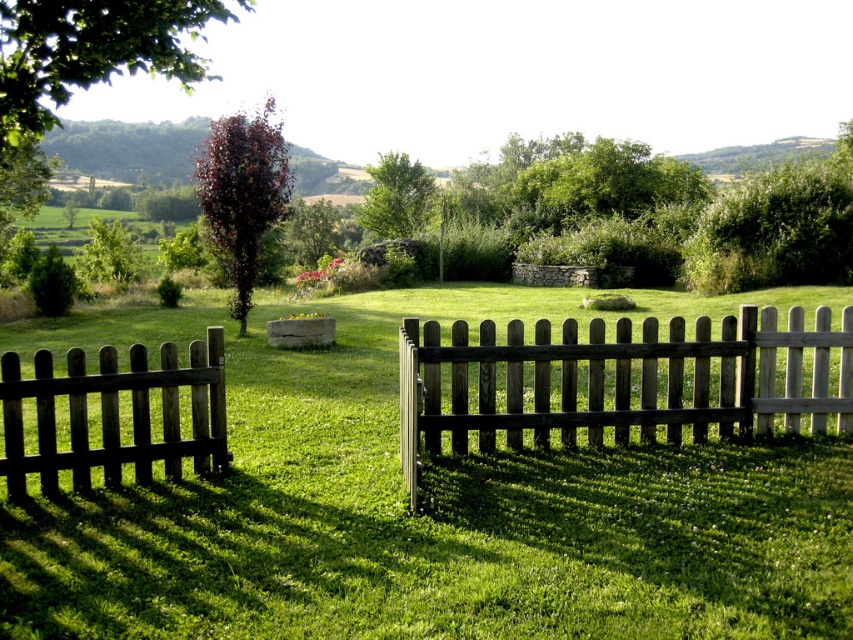
Question: Which point appears closest to the camera in this image?

Choices:
 (A) (618, 397)
 (B) (22, 65)
 (C) (115, 380)

Answer: (B)

Question: Observing the image, what is the correct spatial positioning of wooden picket fence at center in reference to green leafy tree at upper left?

Choices:
 (A) right
 (B) left

Answer: (A)

Question: Observing the image, what is the correct spatial positioning of dark purple leafy tree at center in reference to green leafy tree at center?

Choices:
 (A) below
 (B) above

Answer: (A)

Question: Which of the following is the farthest from the observer?

Choices:
 (A) dark purple leafy tree at center
 (B) green leafy tree at upper left
 (C) wooden picket fence at center

Answer: (A)

Question: Can you confirm if wooden picket fence at center is bigger than green leafy tree at center?

Choices:
 (A) no
 (B) yes

Answer: (A)

Question: Which of the following is the farthest from the observer?

Choices:
 (A) (367, 227)
 (B) (206, 365)

Answer: (A)